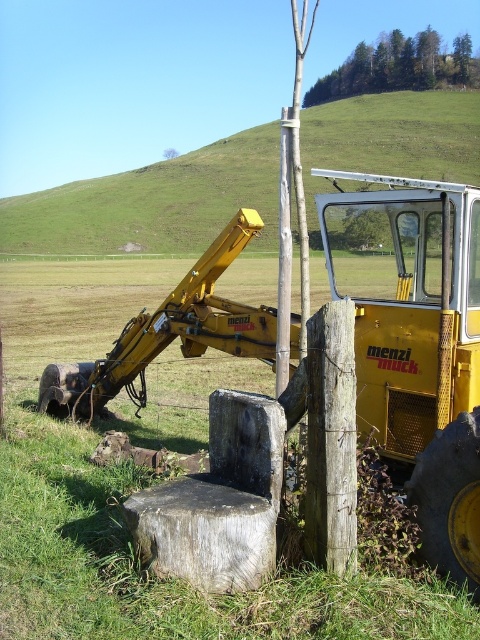
You are standing at the point marked as point (416, 342) in the image. Looking around, you see the yellow rubber tractor at center. What object is located exactly at your current position?

The yellow rubber tractor at center is located exactly at point (416, 342).

You are a farmer standing at the edge of your field. You see the yellow rubber tractor at center and the green leafy tree at upper center. Which object is closer to you?

Result: The yellow rubber tractor at center is closer to you because it is in front of the green leafy tree at upper center.